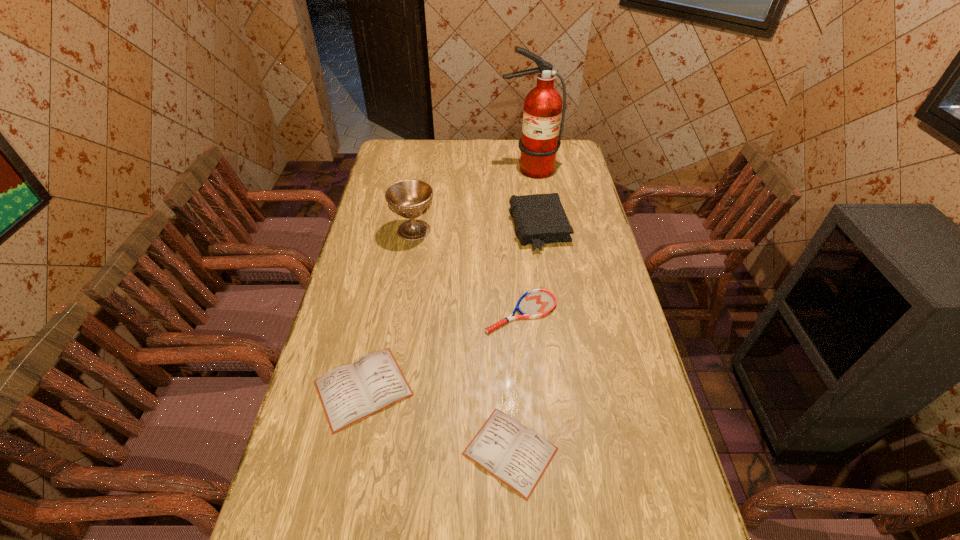
Where is `free space that satisfies the following two spatial constraints: 1. on the front side of the right diary; 2. on the left side of the second tallest object`? This screenshot has width=960, height=540. free space that satisfies the following two spatial constraints: 1. on the front side of the right diary; 2. on the left side of the second tallest object is located at coordinates (377, 451).